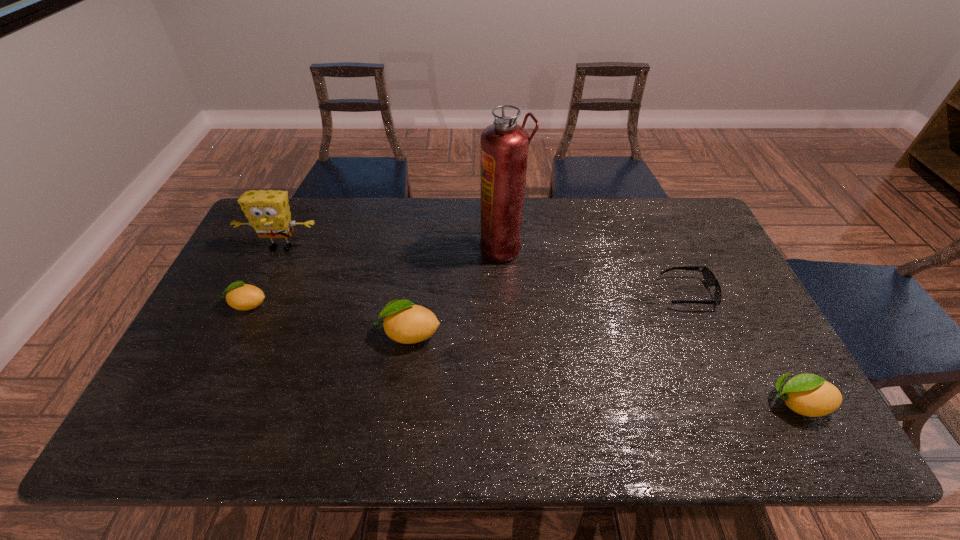
Find the location of a particular element. free location located on the side of the third object from right to left with the label is located at coordinates (408, 248).

The width and height of the screenshot is (960, 540). In order to click on vacant region located on the side of the third object from right to left with the label in this screenshot , I will do `click(443, 248)`.

I want to click on vacant area situated 0.150m on the face of the second tallest object, so click(260, 292).

You are a GUI agent. You are given a task and a screenshot of the screen. Output one action in this format:
    pyautogui.click(x=<x>, y=<y>)
    Task: Click on the fire extinguisher at the far edge
    The width and height of the screenshot is (960, 540).
    Given the screenshot: What is the action you would take?
    point(504,145)

Find the location of a particular element. The image size is (960, 540). sponge positioned at the far edge is located at coordinates [268, 212].

I want to click on object present at the near edge, so pos(807,394).

Find the location of a particular element. lemon that is positioned at the left edge is located at coordinates (241, 296).

The image size is (960, 540). Find the location of `sponge present at the left edge`. sponge present at the left edge is located at coordinates (268, 212).

At what (x,y) coordinates should I click in order to perform the action: click on lemon located in the right edge section of the desktop. Please return your answer as a coordinate pair (x, y). This screenshot has width=960, height=540. Looking at the image, I should click on (807, 394).

You are a GUI agent. You are given a task and a screenshot of the screen. Output one action in this format:
    pyautogui.click(x=<x>, y=<y>)
    Task: Click on the sunglasses located in the right edge section of the desktop
    The image size is (960, 540).
    Given the screenshot: What is the action you would take?
    pyautogui.click(x=709, y=278)